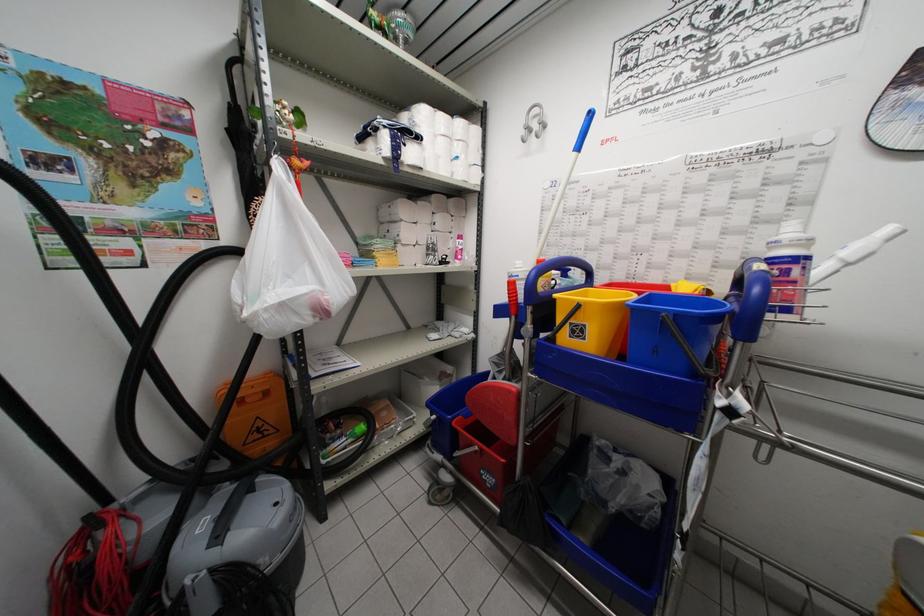
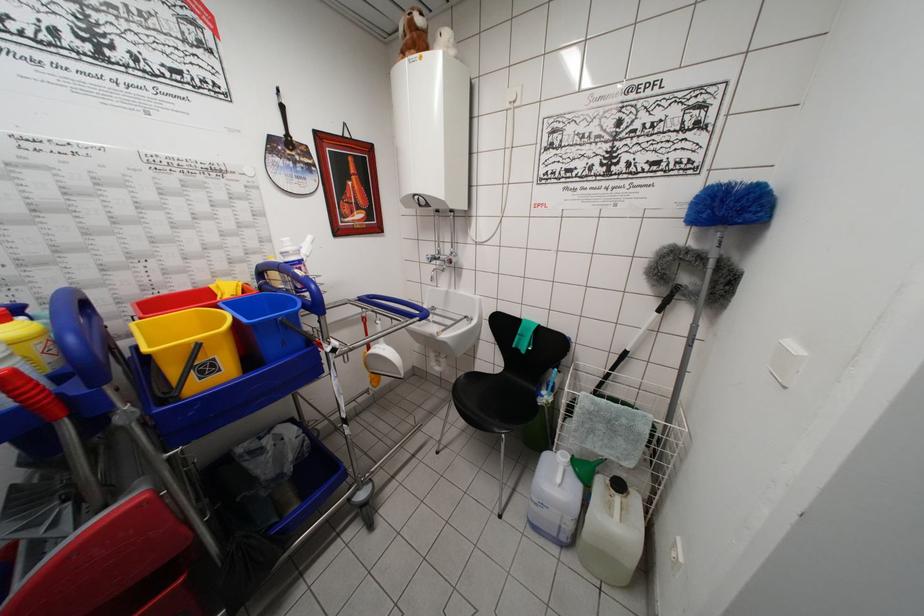
Locate, in the second image, the point that corresponds to pixel 675 322 in the first image.

(287, 323)